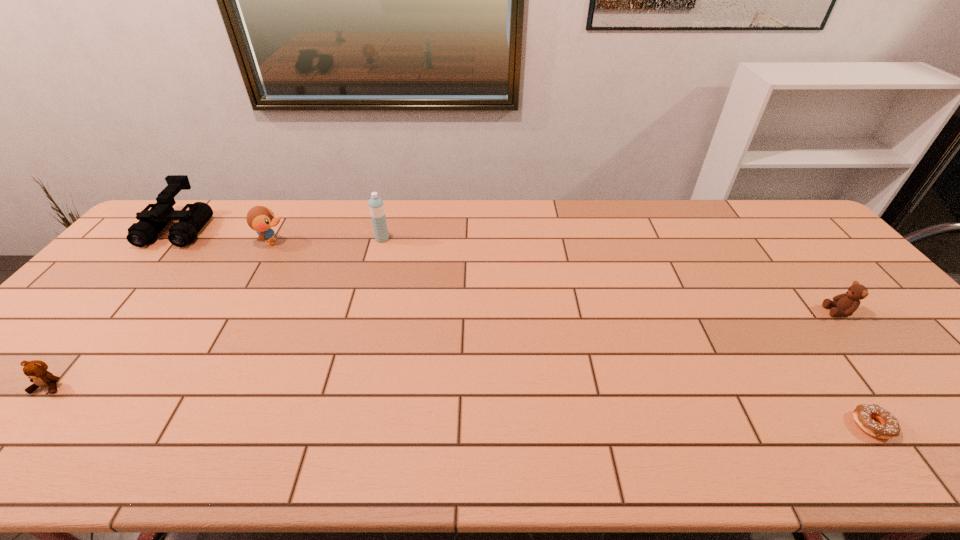
This screenshot has height=540, width=960. Find the location of `vacant space located on the left of the tallest object`. vacant space located on the left of the tallest object is located at coordinates (353, 239).

This screenshot has width=960, height=540. In order to click on vacant area located on the front lenses of the binoculars in this screenshot , I will do `click(152, 261)`.

Find the location of `free region located on the front-facing side of the fourth object from right to left`. free region located on the front-facing side of the fourth object from right to left is located at coordinates (325, 242).

You are a GUI agent. You are given a task and a screenshot of the screen. Output one action in this format:
    pyautogui.click(x=<x>, y=<y>)
    Task: Click on the vacant region located 0.170m on the face of the rightmost object
    The image size is (960, 540).
    Given the screenshot: What is the action you would take?
    pyautogui.click(x=763, y=312)

You are a GUI agent. You are given a task and a screenshot of the screen. Output one action in this format:
    pyautogui.click(x=<x>, y=<y>)
    Task: Click on the vacant region located on the face of the rightmost object
    
    Given the screenshot: What is the action you would take?
    pyautogui.click(x=679, y=312)

At what (x,y) coordinates should I click in order to perform the action: click on free space located on the face of the rightmost object. Please return your answer as a coordinate pair (x, y). The height and width of the screenshot is (540, 960). Looking at the image, I should click on (775, 312).

Find the location of a particular element. The height and width of the screenshot is (540, 960). vacant area situated on the left of the doughnut is located at coordinates (683, 426).

Find the location of a particular element. water bottle that is at the far edge is located at coordinates (376, 206).

Image resolution: width=960 pixels, height=540 pixels. In order to click on binoculars that is positioned at the far edge in this screenshot , I will do `click(151, 222)`.

This screenshot has width=960, height=540. I want to click on duck located in the far edge section of the desktop, so click(x=259, y=218).